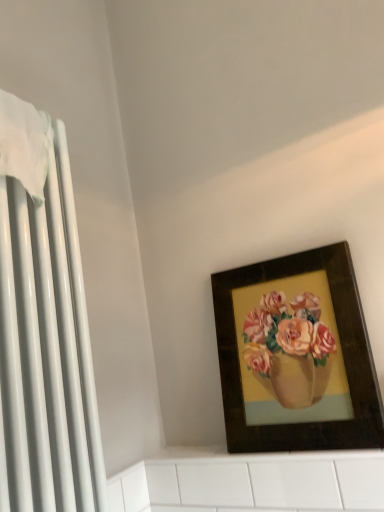
Question: From the image's perspective, would you say white glossy radiator at left is positioned over wooden picture frame at upper right?

Choices:
 (A) yes
 (B) no

Answer: (A)

Question: Is white glossy radiator at left not inside wooden picture frame at upper right?

Choices:
 (A) yes
 (B) no

Answer: (A)

Question: Is white glossy radiator at left to the left of wooden picture frame at upper right from the viewer's perspective?

Choices:
 (A) no
 (B) yes

Answer: (B)

Question: Can you confirm if white glossy radiator at left is positioned to the right of wooden picture frame at upper right?

Choices:
 (A) yes
 (B) no

Answer: (B)

Question: Is white glossy radiator at left in front of wooden picture frame at upper right?

Choices:
 (A) no
 (B) yes

Answer: (B)

Question: Does white glossy radiator at left have a larger size compared to wooden picture frame at upper right?

Choices:
 (A) no
 (B) yes

Answer: (B)

Question: Are wooden picture frame at upper right and white glossy radiator at left located far from each other?

Choices:
 (A) no
 (B) yes

Answer: (A)

Question: Is wooden picture frame at upper right at the right side of white glossy radiator at left?

Choices:
 (A) no
 (B) yes

Answer: (B)

Question: From the image's perspective, is wooden picture frame at upper right above white glossy radiator at left?

Choices:
 (A) no
 (B) yes

Answer: (A)

Question: From a real-world perspective, is wooden picture frame at upper right on top of white glossy radiator at left?

Choices:
 (A) no
 (B) yes

Answer: (A)

Question: Is white glossy radiator at left a part of wooden picture frame at upper right?

Choices:
 (A) yes
 (B) no

Answer: (B)

Question: Considering the relative positions of wooden picture frame at upper right and white glossy radiator at left in the image provided, is wooden picture frame at upper right in front of white glossy radiator at left?

Choices:
 (A) yes
 (B) no

Answer: (B)

Question: From the image's perspective, is white glossy radiator at left above or below wooden picture frame at upper right?

Choices:
 (A) below
 (B) above

Answer: (B)